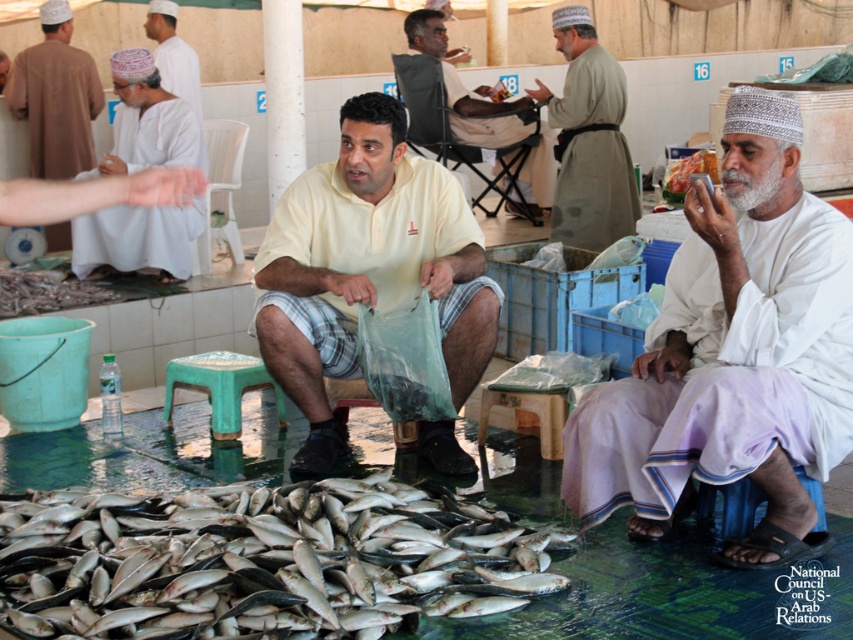
You are a customer at the fish market and want to know which item takes up more space between the matte white robe at upper left and the white cotton headscarf at upper left. Which one should you consider?

The white cotton headscarf at upper left takes up more space than the matte white robe at upper left, so you should consider the white cotton headscarf at upper left.

What is located at the point with coordinates [733,353] in the image?

The point with coordinates [733,353] corresponds to the white cotton turban at upper right.